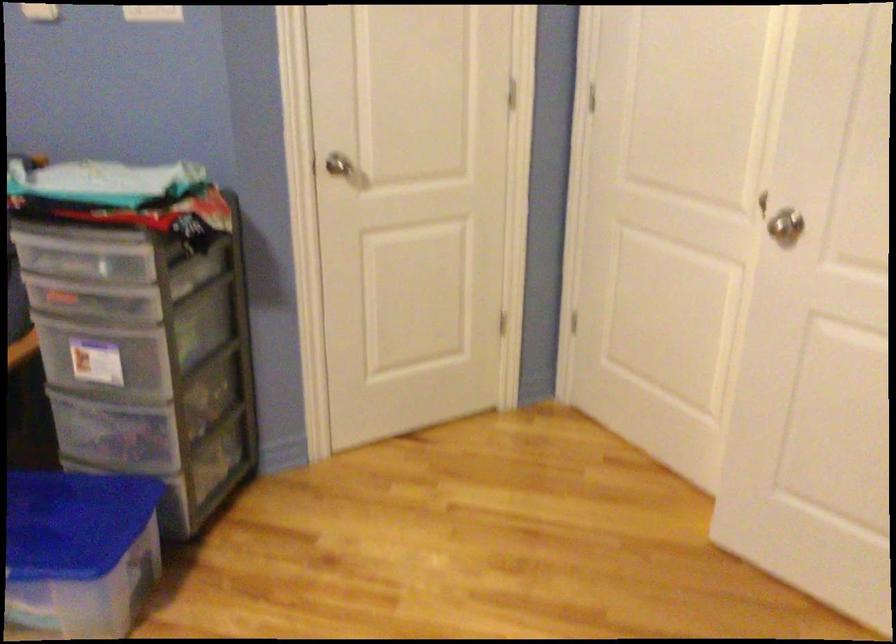
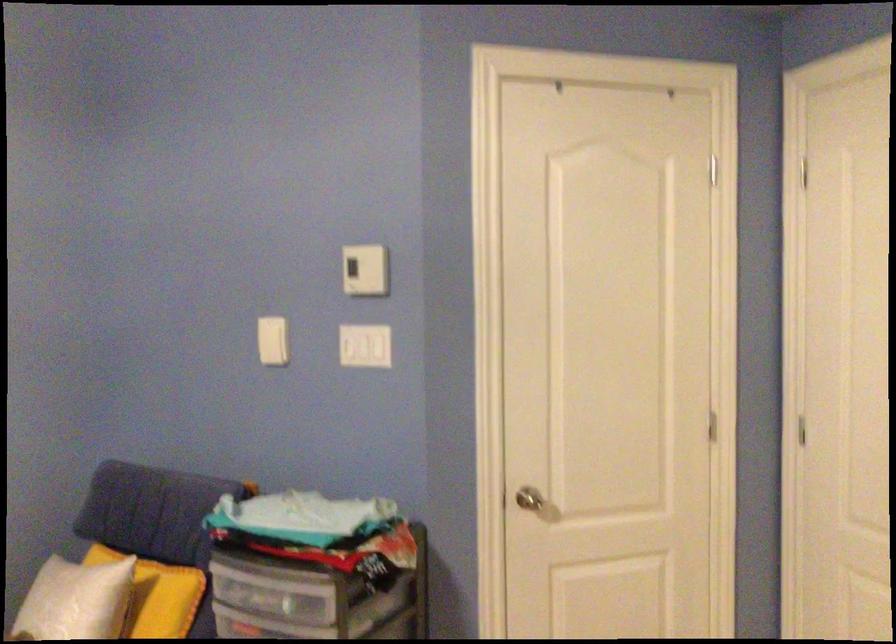
In the second image, find the point that corresponds to point (83, 263) in the first image.

(270, 592)